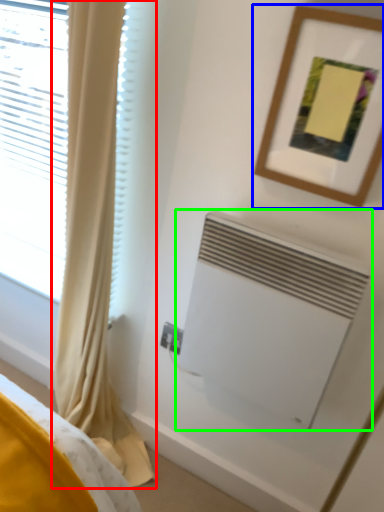
Question: Which object is positioned closest to curtain (highlighted by a red box)? Select from picture frame (highlighted by a blue box) and air conditioning (highlighted by a green box).

Choices:
 (A) picture frame
 (B) air conditioning

Answer: (B)